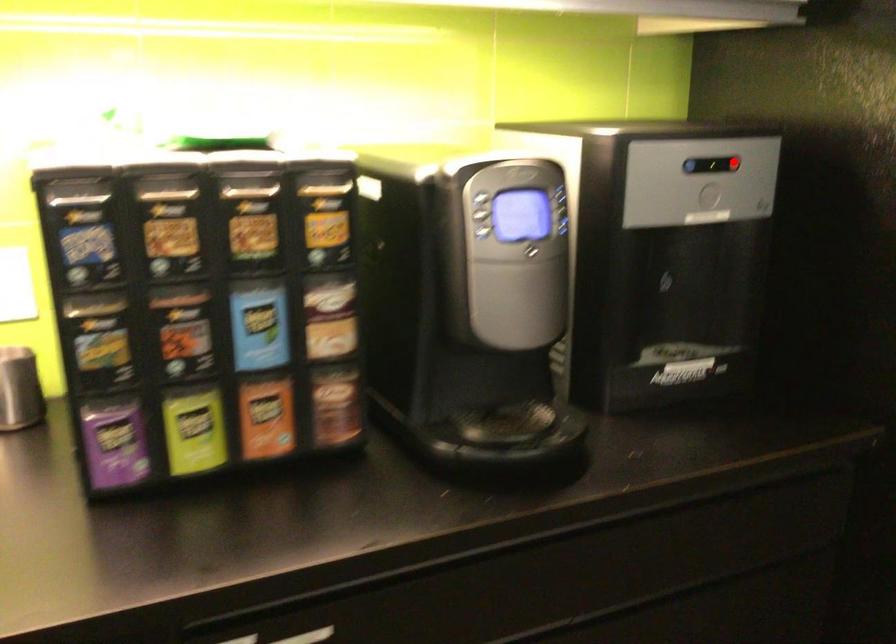
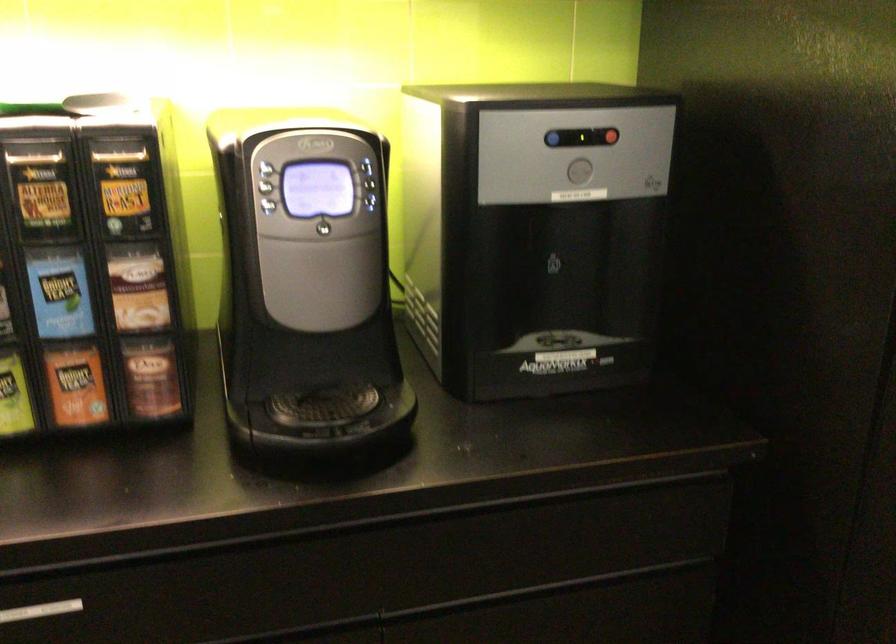
Where in the second image is the point corresponding to the highlighted location from the first image?

(612, 136)